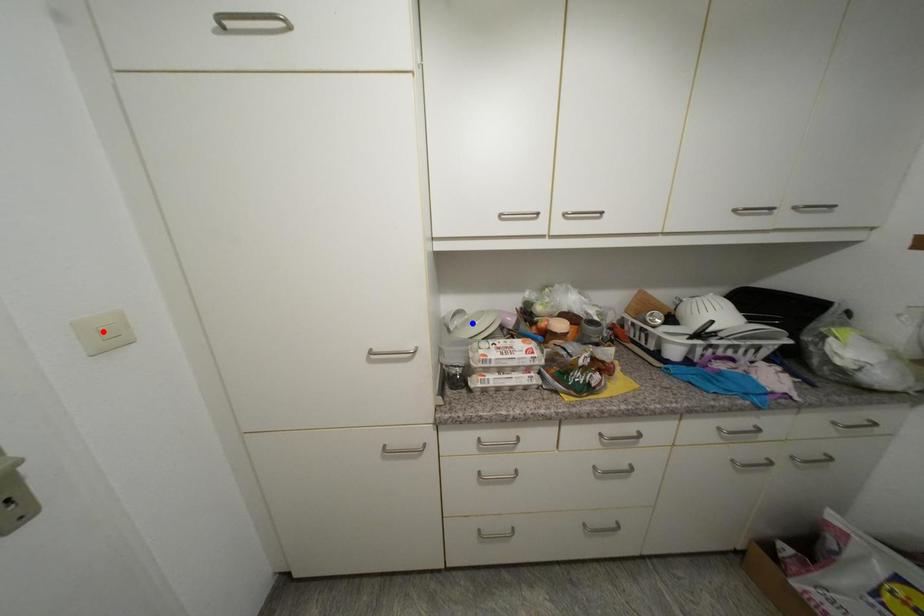
Question: In the image, two points are highlighted. Which point is nearer to the camera? Reply with the corresponding letter.

Choices:
 (A) blue point
 (B) red point

Answer: (B)